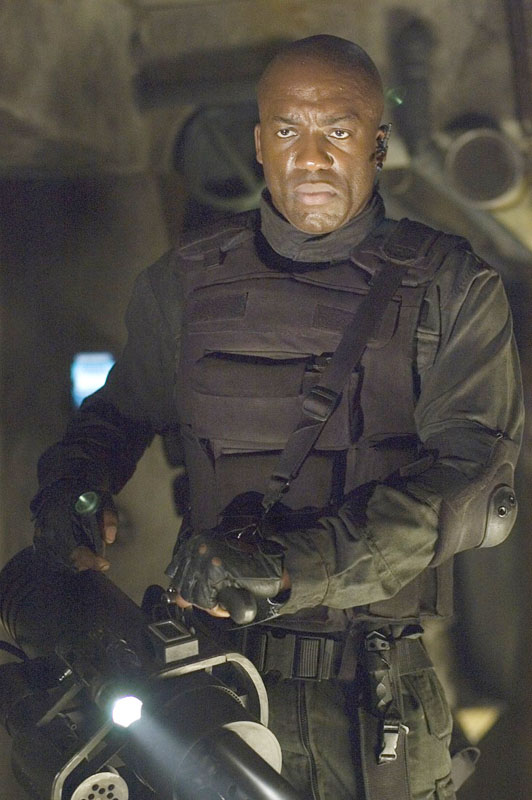
This screenshot has height=800, width=532. Find the location of `monitor`. monitor is located at coordinates (76, 370).